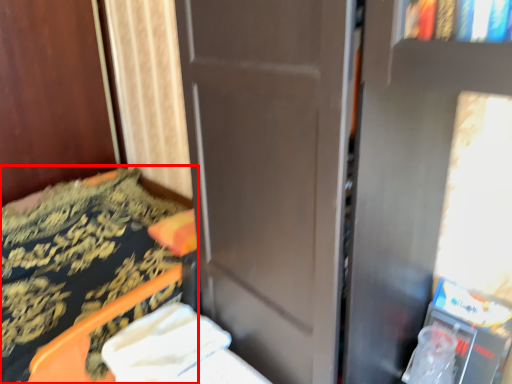
Question: From the image's perspective, considering the relative positions of furniture (annotated by the red box) and sheet in the image provided, where is furniture (annotated by the red box) located with respect to the staircase?

Choices:
 (A) below
 (B) above

Answer: (B)